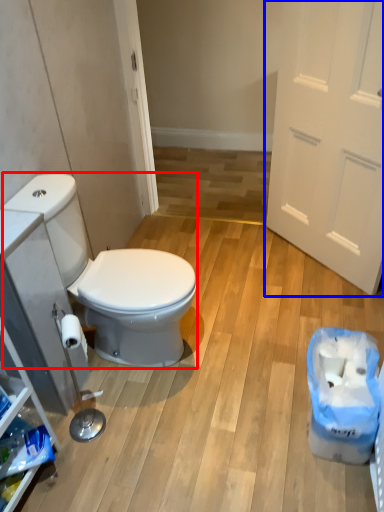
Question: Which of the following is the closest to the observer, sit (highlighted by a red box) or door (highlighted by a blue box)?

Choices:
 (A) sit
 (B) door

Answer: (A)